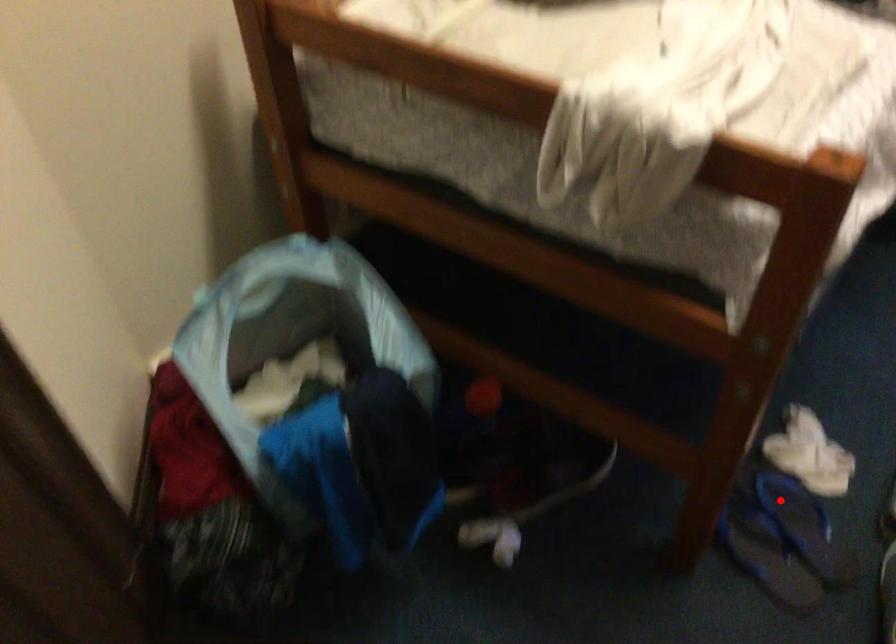
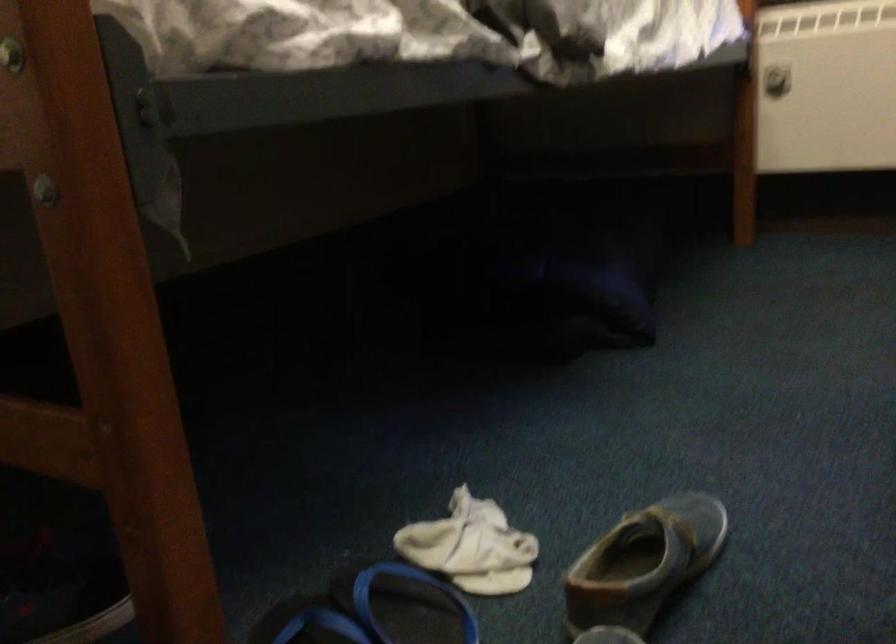
Where in the second image is the point corresponding to the highlighted location from the first image?

(406, 605)